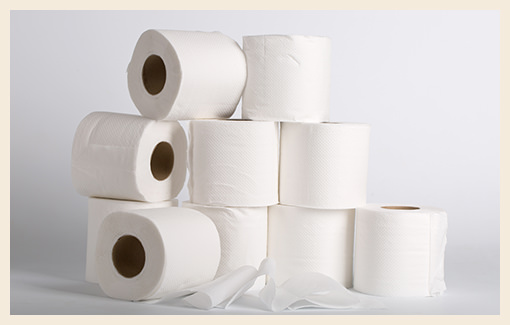
This screenshot has width=510, height=325. Find the location of `rolls of toilet paper on the bottom of the stack`. rolls of toilet paper on the bottom of the stack is located at coordinates (103, 205), (166, 232), (229, 227), (299, 223), (405, 230).